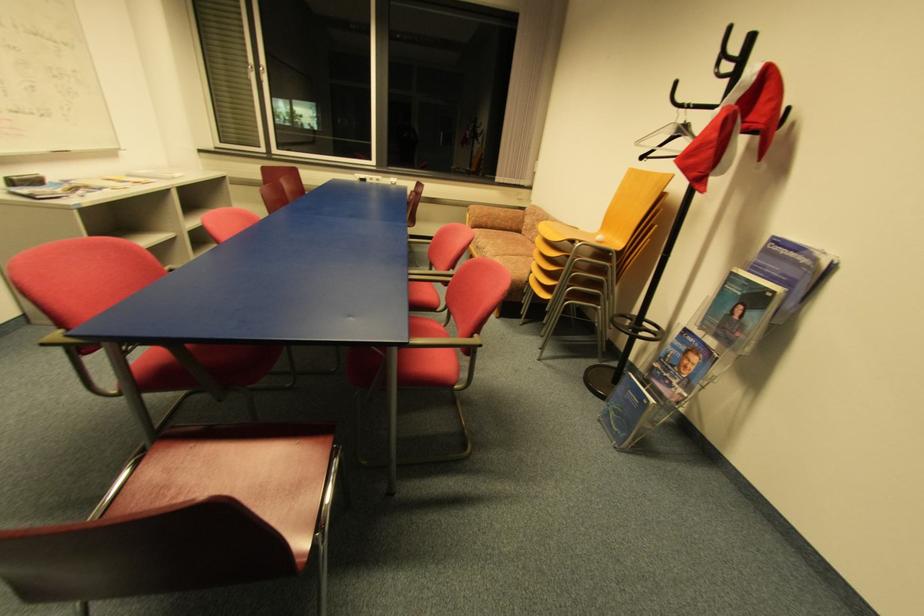
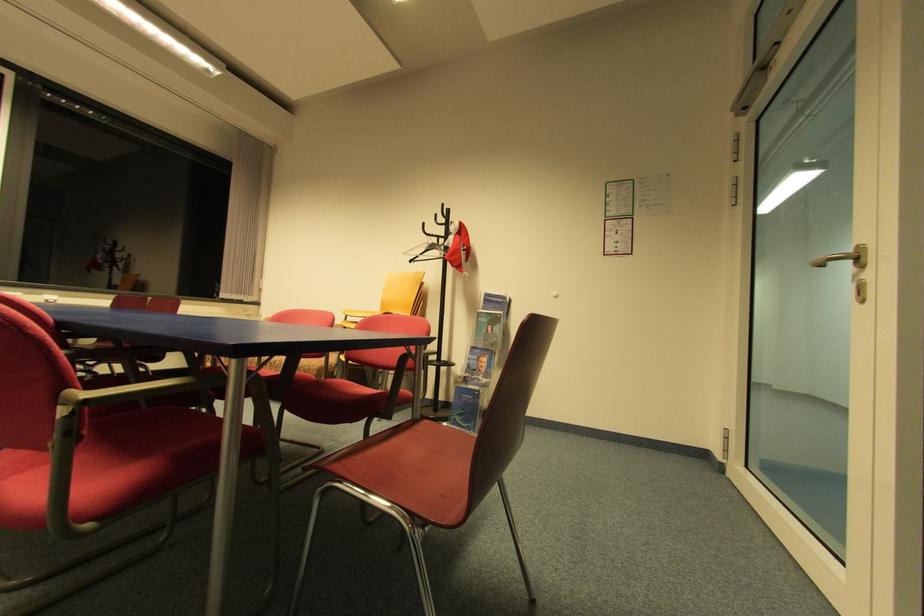
Locate, in the second image, the point that corresponds to the point at 756,39 in the first image.

(453, 212)